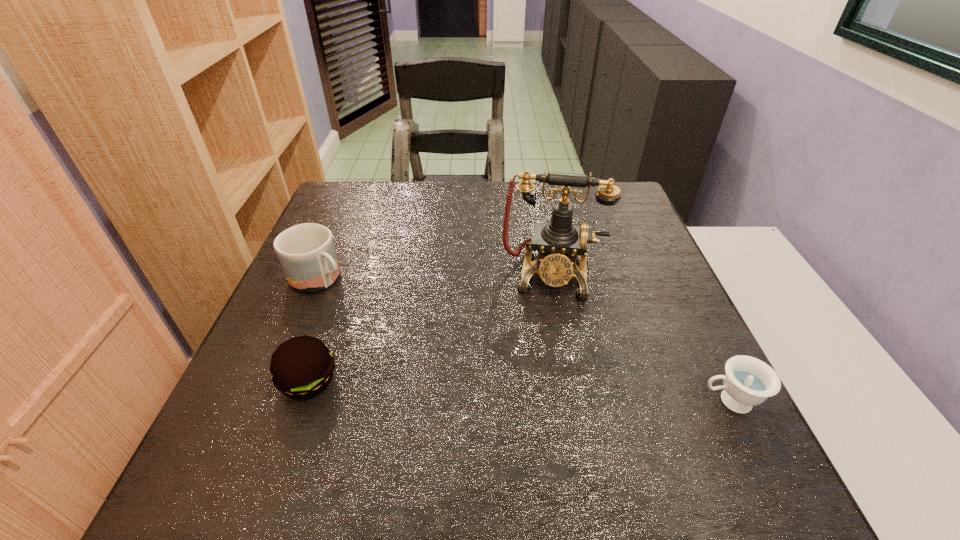
Where is `vacant space that's between the telephone and the second tallest object`? Image resolution: width=960 pixels, height=540 pixels. vacant space that's between the telephone and the second tallest object is located at coordinates (436, 277).

Find the location of `object that ranks as the closest to the mug`. object that ranks as the closest to the mug is located at coordinates (302, 367).

The image size is (960, 540). What are the coordinates of `object that stands as the third closest to the teacup` in the screenshot? It's located at 306,252.

The width and height of the screenshot is (960, 540). Identify the location of free point that satisfies the following two spatial constraints: 1. on the front side of the patty; 2. on the left side of the second tallest object. (277, 381).

At what (x,y) coordinates should I click in order to perform the action: click on free spot that satisfies the following two spatial constraints: 1. on the back side of the patty; 2. on the right side of the third object from left to right. Please return your answer as a coordinate pair (x, y). The width and height of the screenshot is (960, 540). Looking at the image, I should click on (347, 275).

Identify the location of vacant point that satisfies the following two spatial constraints: 1. on the front side of the telephone; 2. on the side of the rightmost object with the handle. (575, 401).